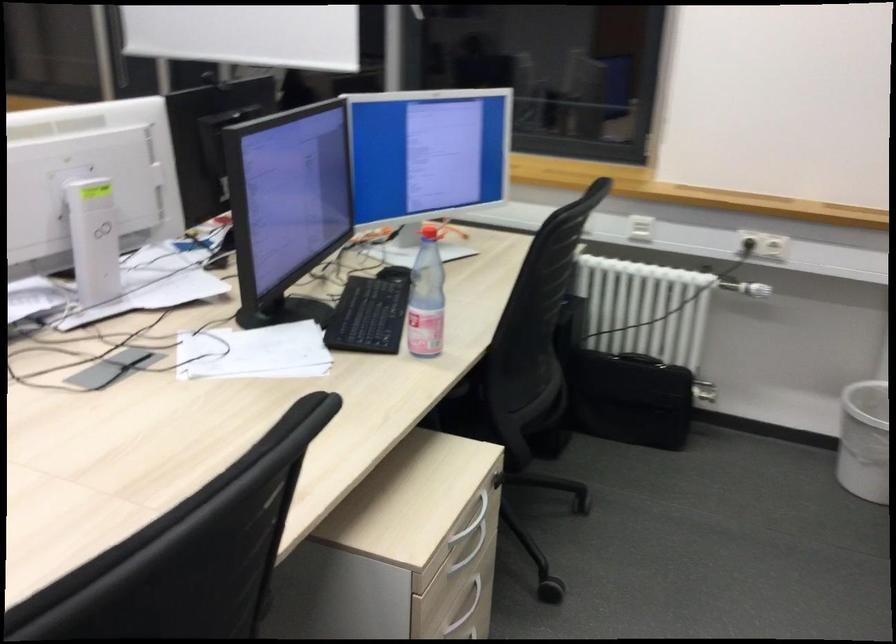
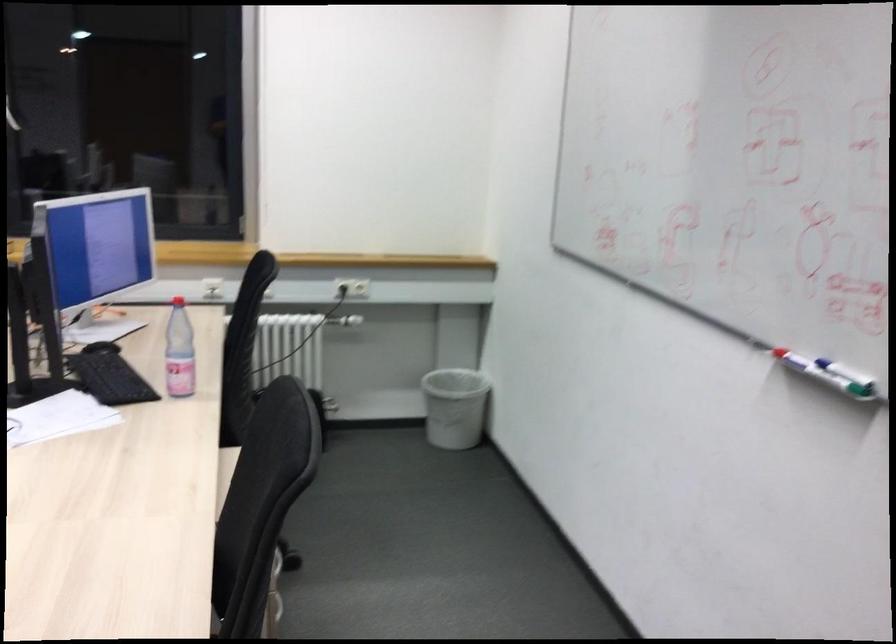
In the second image, find the point that corresponds to point 756,247 in the first image.

(352, 287)